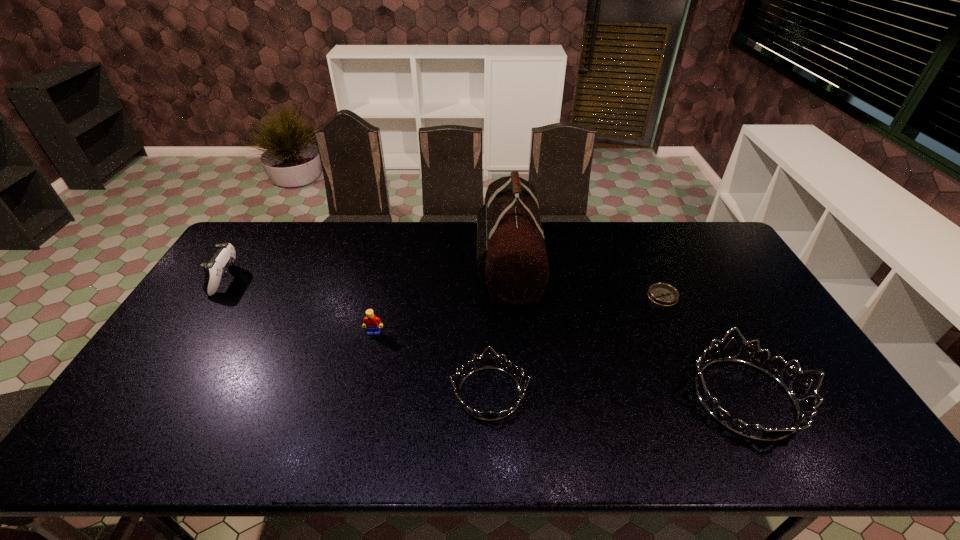
Where is `free space located 0.400m on the front-facing side of the right tiara`? Image resolution: width=960 pixels, height=540 pixels. free space located 0.400m on the front-facing side of the right tiara is located at coordinates (527, 398).

Locate an element on the screen. The height and width of the screenshot is (540, 960). vacant point located 0.290m on the front pocket of the duffel bag is located at coordinates (392, 264).

At what (x,y) coordinates should I click in order to perform the action: click on free location located 0.280m on the front pocket of the duffel bag. Please return your answer as a coordinate pair (x, y). Looking at the image, I should click on (395, 264).

Where is `vacant space located on the front pocket of the duffel bag`? vacant space located on the front pocket of the duffel bag is located at coordinates (435, 264).

You are a GUI agent. You are given a task and a screenshot of the screen. Output one action in this format:
    pyautogui.click(x=<x>, y=<y>)
    Task: Click on the free region located 0.140m on the face of the Lego
    This screenshot has width=960, height=540.
    Given the screenshot: What is the action you would take?
    pyautogui.click(x=364, y=376)

Locate an element on the screen. The image size is (960, 540). free location located on the front-facing side of the control is located at coordinates (359, 280).

Where is `vacant space located on the back of the compass`? The height and width of the screenshot is (540, 960). vacant space located on the back of the compass is located at coordinates (644, 255).

At what (x,y) coordinates should I click in order to perform the action: click on object positioned at the far edge. Please return your answer as a coordinate pair (x, y). The image size is (960, 540). Looking at the image, I should click on (511, 254).

At what (x,y) coordinates should I click in order to perform the action: click on object that is at the left edge. Please return your answer as a coordinate pair (x, y). The width and height of the screenshot is (960, 540). Looking at the image, I should click on (217, 268).

The width and height of the screenshot is (960, 540). Find the location of `object present at the right edge`. object present at the right edge is located at coordinates (797, 389).